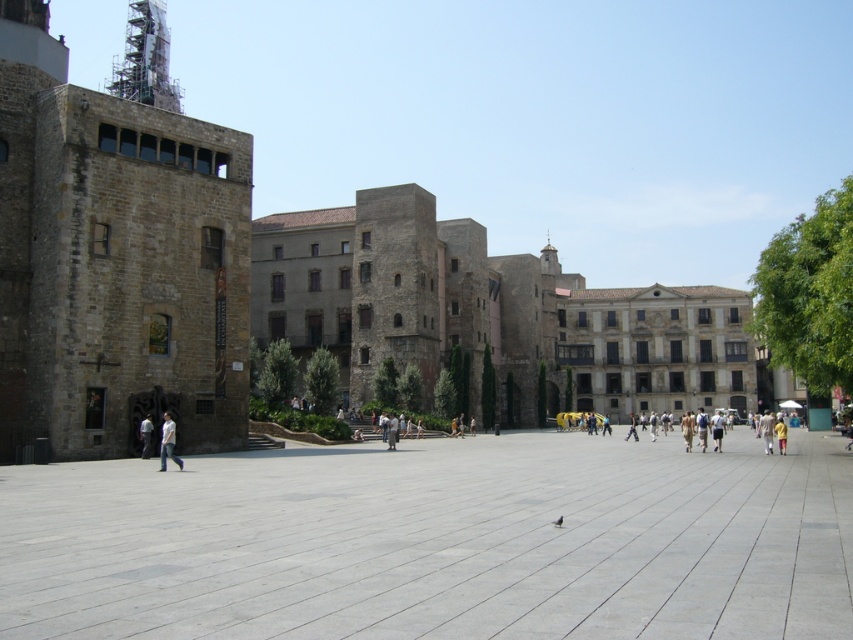
You are standing at the entrance of the plaza and want to reach the smooth concrete courtyard at center. According to the coordinates provided, which direction should you move to reach it?

The smooth concrete courtyard at center is located at coordinates point (x=437, y=541), so you should move towards the center of the plaza to reach it.

Based on the photo, you are standing in the plaza and want to take a photo of the historic buildings. You notice the smooth concrete courtyard at center and the white matte shirt at lower left in your viewfinder. Which object should you adjust your camera to focus on if you want to capture the one that is closer to the front of the scene?

You should focus on the white matte shirt at lower left because it is positioned in front of the smooth concrete courtyard at center, making it closer to the front of the scene.